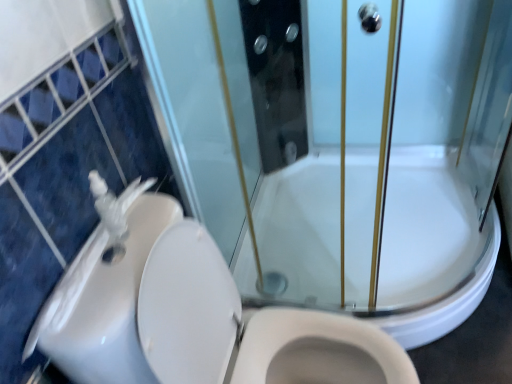
Question: Can you confirm if white glossy toilet at lower left is smaller than white glossy sink at left?

Choices:
 (A) no
 (B) yes

Answer: (A)

Question: From a real-world perspective, is white glossy toilet at lower left below white glossy sink at left?

Choices:
 (A) no
 (B) yes

Answer: (B)

Question: Is white glossy toilet at lower left not close to white glossy sink at left?

Choices:
 (A) no
 (B) yes

Answer: (A)

Question: Is white glossy toilet at lower left placed right next to white glossy sink at left?

Choices:
 (A) no
 (B) yes

Answer: (B)

Question: Is white glossy sink at left inside white glossy toilet at lower left?

Choices:
 (A) yes
 (B) no

Answer: (A)

Question: Can we say white glossy toilet at lower left lies outside white glossy sink at left?

Choices:
 (A) no
 (B) yes

Answer: (B)

Question: Is white glossy toilet at lower left directly adjacent to white glossy bath at center?

Choices:
 (A) yes
 (B) no

Answer: (B)

Question: Can you confirm if white glossy toilet at lower left is thinner than white glossy bath at center?

Choices:
 (A) yes
 (B) no

Answer: (A)

Question: Can you confirm if white glossy toilet at lower left is positioned to the left of white glossy bath at center?

Choices:
 (A) yes
 (B) no

Answer: (A)

Question: From the image's perspective, is white glossy toilet at lower left below white glossy bath at center?

Choices:
 (A) yes
 (B) no

Answer: (A)

Question: Is white glossy toilet at lower left located outside white glossy bath at center?

Choices:
 (A) no
 (B) yes

Answer: (B)

Question: Is white glossy bath at center located within white glossy toilet at lower left?

Choices:
 (A) no
 (B) yes

Answer: (A)

Question: Is white glossy sink at left surrounding white glossy toilet at lower left?

Choices:
 (A) yes
 (B) no

Answer: (B)